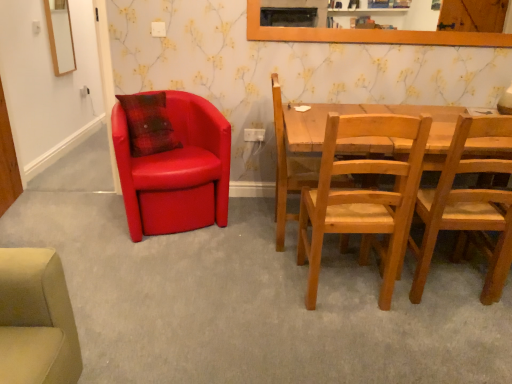
I want to click on vacant space that is to the left of natural wood chair at center, placed as the second chair when sorted from right to left, so [x=262, y=285].